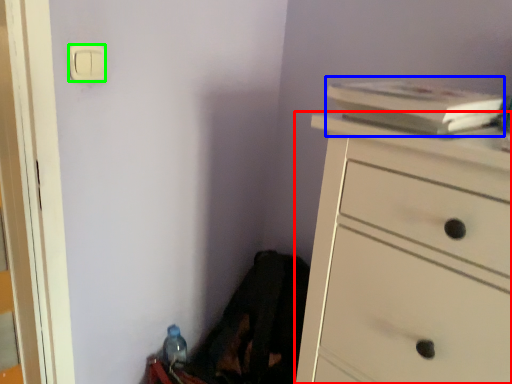
Question: Based on their relative distances, which object is farther from chest of drawers (highlighted by a red box)? Choose from book (highlighted by a blue box) and light switch (highlighted by a green box).

Choices:
 (A) book
 (B) light switch

Answer: (B)